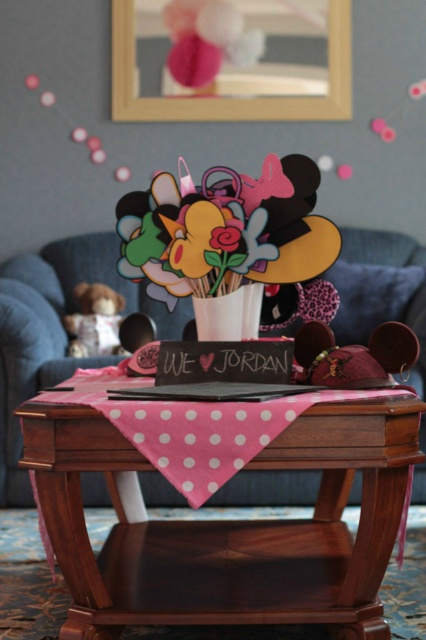
Question: Can you confirm if wooden table at center is positioned above matte pink fabric armchair at center?

Choices:
 (A) no
 (B) yes

Answer: (A)

Question: Which point is closer to the camera?

Choices:
 (A) matte pink fabric armchair at center
 (B) wooden table at center

Answer: (B)

Question: Is wooden table at center smaller than matte pink fabric armchair at center?

Choices:
 (A) yes
 (B) no

Answer: (A)

Question: Is wooden table at center above matte pink fabric armchair at center?

Choices:
 (A) yes
 (B) no

Answer: (B)

Question: Which object appears farthest from the camera in this image?

Choices:
 (A) wooden table at center
 (B) matte pink fabric armchair at center

Answer: (B)

Question: Which object is closer to the camera taking this photo?

Choices:
 (A) matte pink fabric armchair at center
 (B) wooden table at center

Answer: (B)